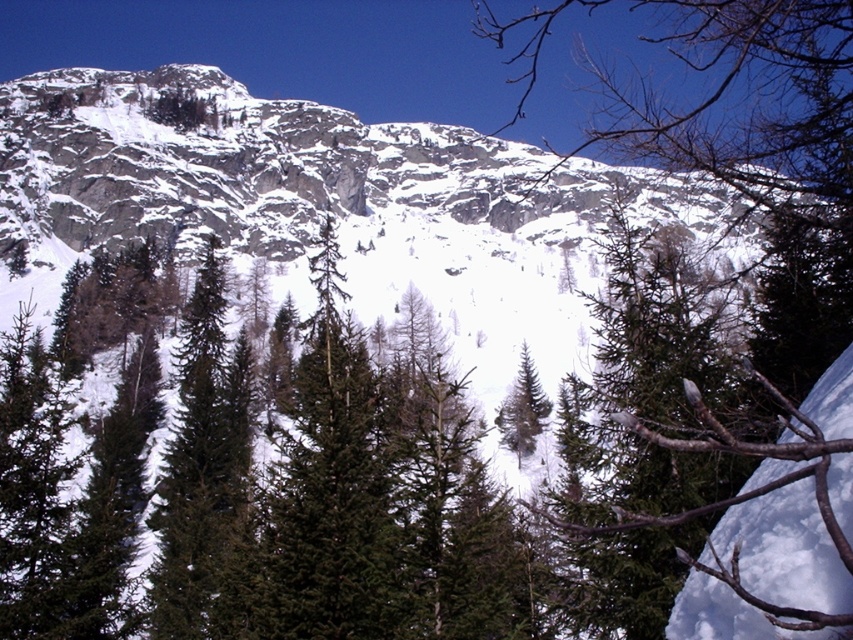
Question: Can you confirm if rocky gray mountain at upper center is thinner than green matte tree at center?

Choices:
 (A) no
 (B) yes

Answer: (A)

Question: Which object appears closest to the camera in this image?

Choices:
 (A) green matte tree at center
 (B) rocky gray mountain at upper center

Answer: (A)

Question: Does rocky gray mountain at upper center have a larger size compared to green matte tree at center?

Choices:
 (A) no
 (B) yes

Answer: (A)

Question: Which of the following is the farthest from the observer?

Choices:
 (A) (795, 330)
 (B) (476, 209)

Answer: (B)

Question: Can you confirm if rocky gray mountain at upper center is smaller than green matte tree at center?

Choices:
 (A) yes
 (B) no

Answer: (A)